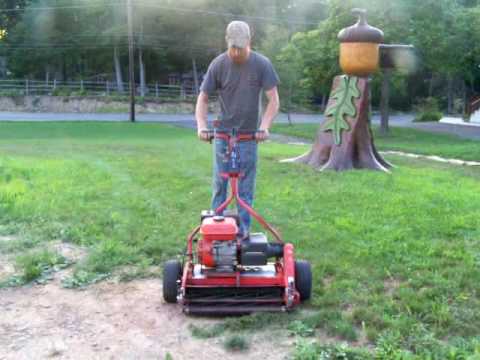
Image resolution: width=480 pixels, height=360 pixels. I want to click on leaf of a fake tree, so click(x=347, y=99).